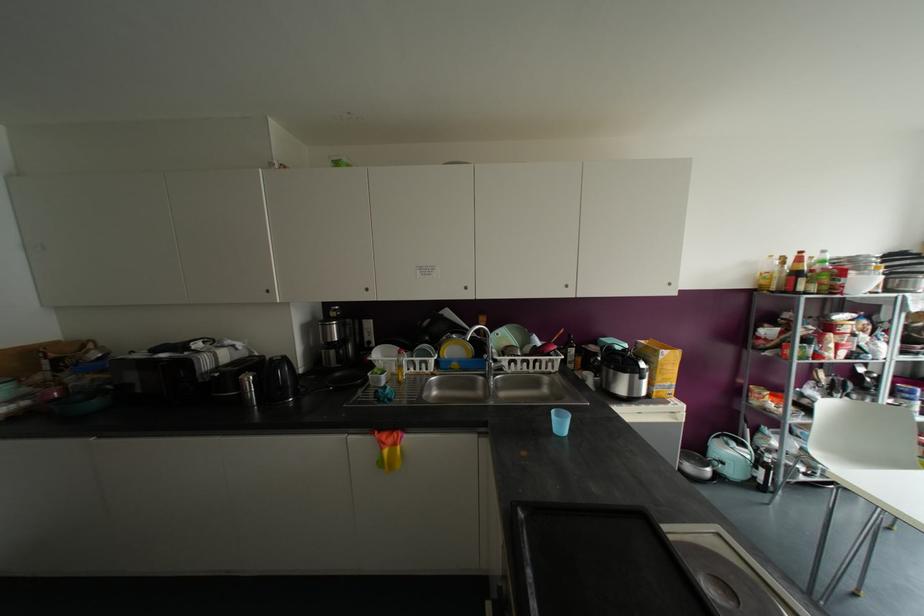
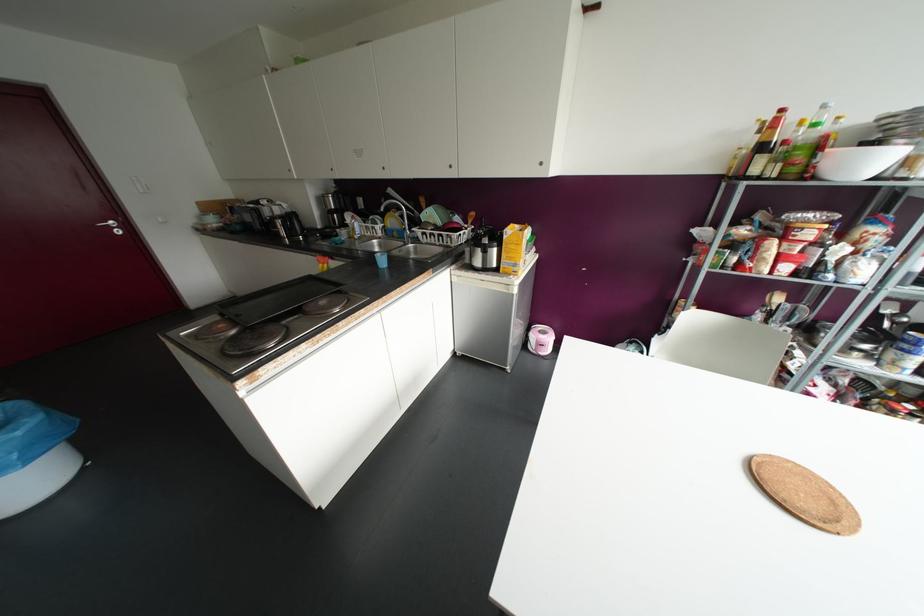
Question: I am providing you with two images of the same scene from different viewpoints. Please identify which objects are invisible in image2.

Choices:
 (A) faucet handle
 (B) clear glass bottle
 (C) blue plastic cup
 (D) none of these

Answer: (D)